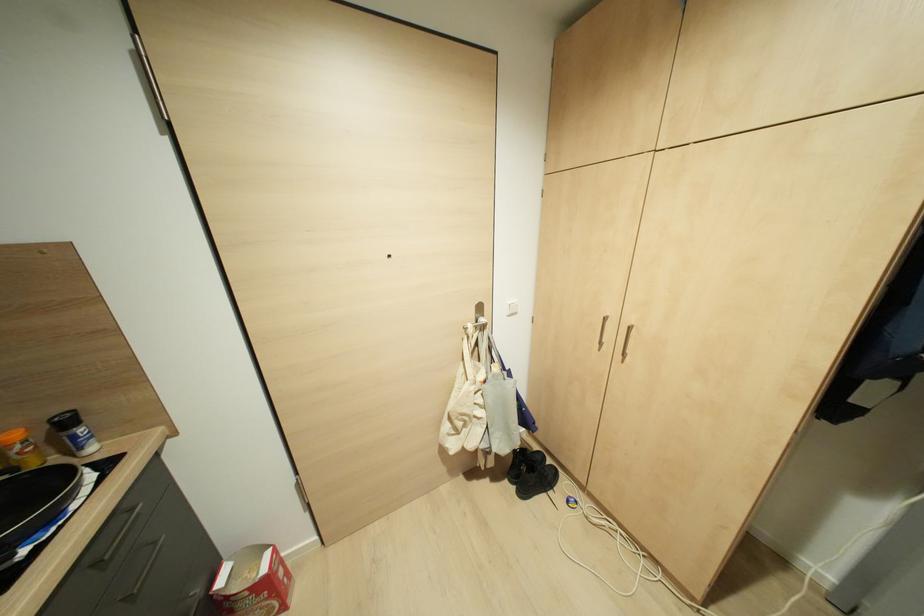
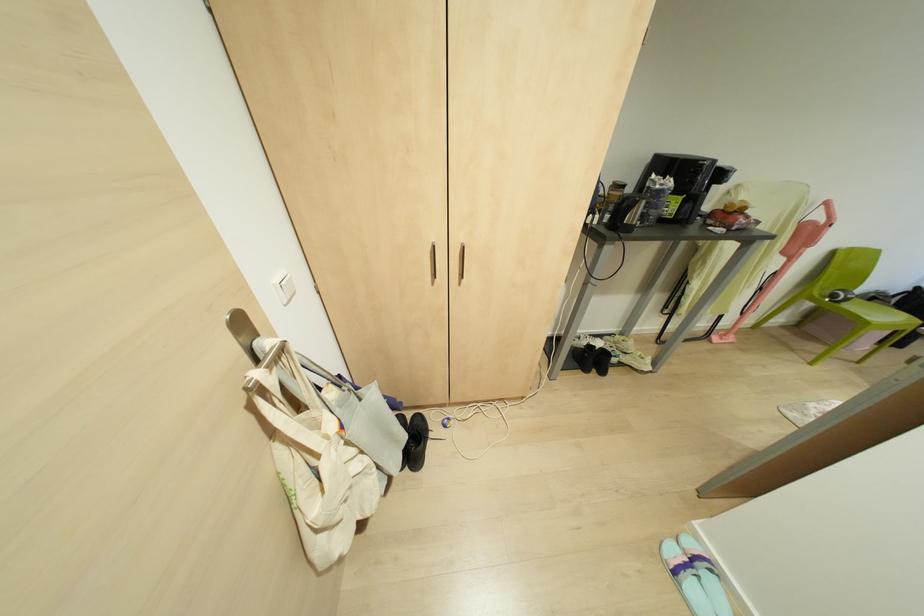
Where in the second image is the point corresponding to (x=622, y=361) from the first image?

(458, 284)